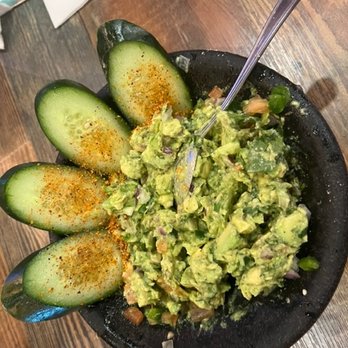
Where is `darker brown part of table`? This screenshot has width=348, height=348. darker brown part of table is located at coordinates point(80,57), point(38,68).